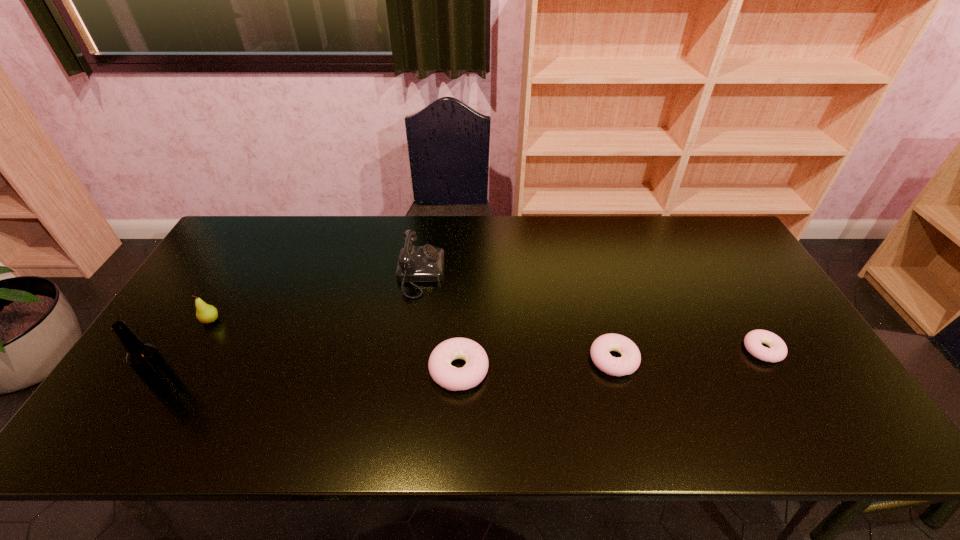
Where is `doughnut that is the second closest to the fifth nearest object`? doughnut that is the second closest to the fifth nearest object is located at coordinates click(629, 362).

Image resolution: width=960 pixels, height=540 pixels. I want to click on vacant space that satisfies the following two spatial constraints: 1. on the dial of the fifth object from left to right; 2. on the right side of the telephone, so click(408, 360).

The height and width of the screenshot is (540, 960). In order to click on vacant area that satisfies the following two spatial constraints: 1. on the dial of the leftmost doughnut; 2. on the left side of the telephone in this screenshot , I will do `click(406, 369)`.